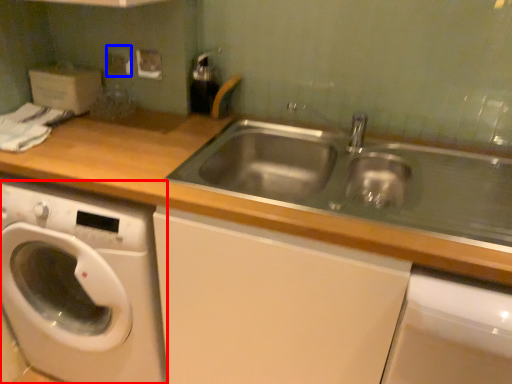
Question: Which of the following is the farthest to the observer, washing machine (highlighted by a red box) or electric outlet (highlighted by a blue box)?

Choices:
 (A) washing machine
 (B) electric outlet

Answer: (B)